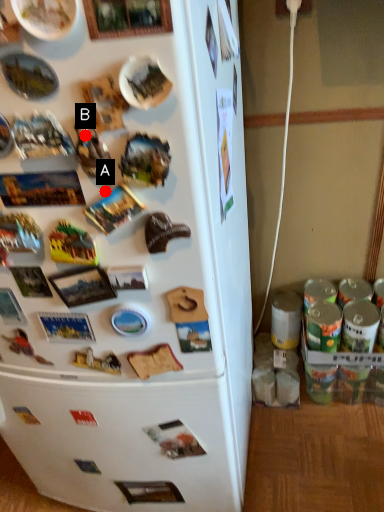
Question: Two points are circled on the image, labeled by A and B beside each circle. Which of the following is the closest to the observer?

Choices:
 (A) A is closer
 (B) B is closer

Answer: (B)